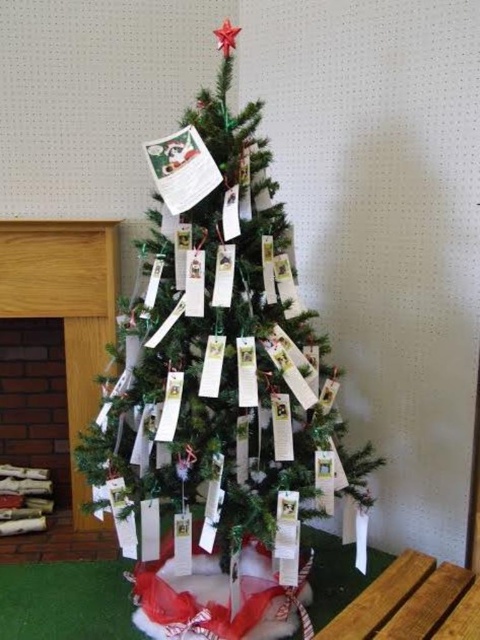
Question: Is green matte christmas tree at center positioned in front of white paper card at center?

Choices:
 (A) no
 (B) yes

Answer: (B)

Question: Is green matte christmas tree at center above white paper card at center?

Choices:
 (A) yes
 (B) no

Answer: (B)

Question: Among these points, which one is farthest from the camera?

Choices:
 (A) [207, 179]
 (B) [276, 337]

Answer: (B)

Question: Can you confirm if green matte christmas tree at center is positioned above white paper card at center?

Choices:
 (A) no
 (B) yes

Answer: (A)

Question: Which point is closer to the camera taking this photo?

Choices:
 (A) (172, 177)
 (B) (264, 173)

Answer: (A)